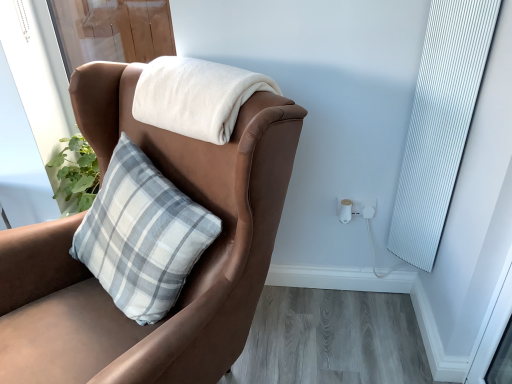
Question: In terms of height, does white ribbed curtain at right look taller or shorter compared to white plastic electric outlet at lower right?

Choices:
 (A) tall
 (B) short

Answer: (A)

Question: Considering the positions of white ribbed curtain at right and white plastic electric outlet at lower right in the image, is white ribbed curtain at right wider or thinner than white plastic electric outlet at lower right?

Choices:
 (A) wide
 (B) thin

Answer: (A)

Question: Which is farther from the white plastic electric outlet at lower right?

Choices:
 (A) brown leather chair at upper left
 (B) white ribbed curtain at right
 (C) white soft blanket at upper center

Answer: (A)

Question: Which object is the farthest from the white ribbed curtain at right?

Choices:
 (A) brown leather chair at upper left
 (B) white plastic electric outlet at lower right
 (C) white soft blanket at upper center

Answer: (A)